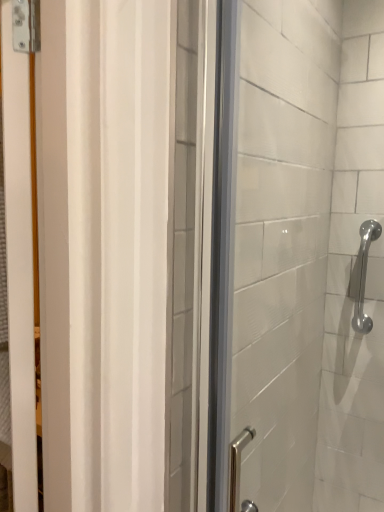
The width and height of the screenshot is (384, 512). I want to click on satin nickel grab bar at right, so click(x=364, y=275).

Image resolution: width=384 pixels, height=512 pixels. Describe the element at coordinates (364, 275) in the screenshot. I see `satin nickel grab bar at right` at that location.

This screenshot has height=512, width=384. Find the location of `satin nickel grab bar at right`. satin nickel grab bar at right is located at coordinates (364, 275).